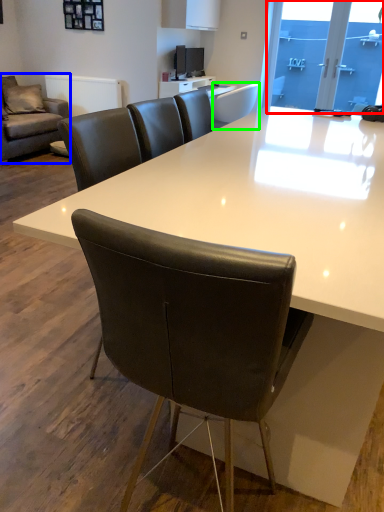
Question: Which object is positioned farthest from window screen (highlighted by a red box)? Select from studio couch (highlighted by a blue box) and chair (highlighted by a green box).

Choices:
 (A) studio couch
 (B) chair

Answer: (A)